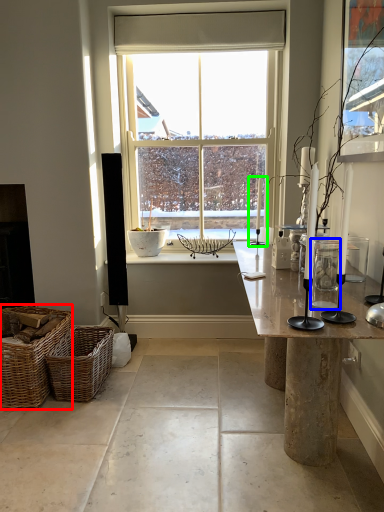
Question: Considering the real-world distances, which object is farthest from picnic basket (highlighted by a red box)? glass vase (highlighted by a blue box) or candle holder (highlighted by a green box)?

Choices:
 (A) glass vase
 (B) candle holder

Answer: (B)